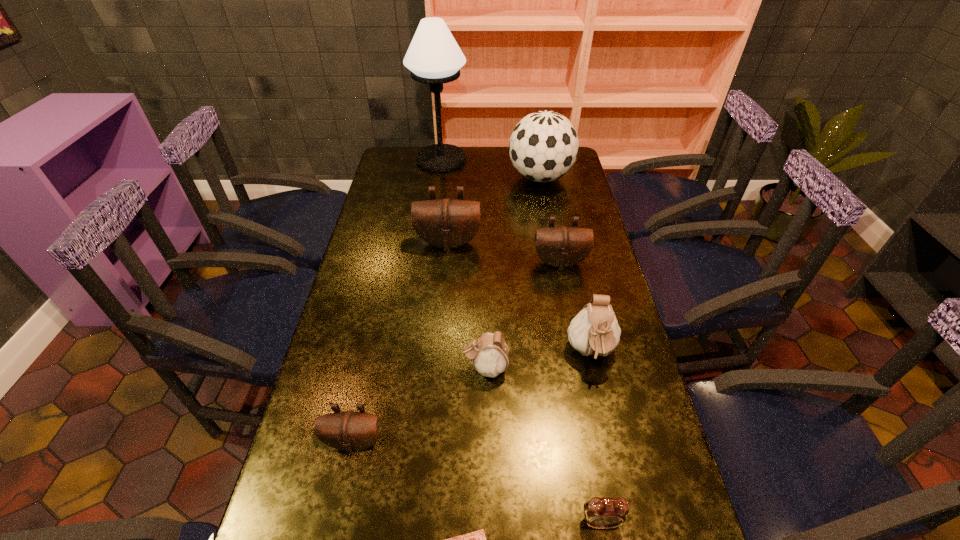
Identify which object is the fourth closest to the nearest pouch. Please provide its 2D coordinates. Your answer should be formatted as a tuple, i.e. [(x, y)], where the tuple contains the x and y coordinates of a point satisfying the conditions above.

[(594, 330)]

Locate which object ranks seventh in proximity to the left white pouch. Please provide its 2D coordinates. Your answer should be formatted as a tuple, i.e. [(x, y)], where the tuple contains the x and y coordinates of a point satisfying the conditions above.

[(543, 147)]

Select which pouch is the closest to the rightmost brown pouch. Please provide its 2D coordinates. Your answer should be formatted as a tuple, i.e. [(x, y)], where the tuple contains the x and y coordinates of a point satisfying the conditions above.

[(446, 223)]

Select which pouch appears as the fourth closest to the second biggest brown pouch. Please provide its 2D coordinates. Your answer should be formatted as a tuple, i.e. [(x, y)], where the tuple contains the x and y coordinates of a point satisfying the conditions above.

[(349, 431)]

Where is `brown pouch that stands as the closest to the nearest brown pouch`? This screenshot has height=540, width=960. brown pouch that stands as the closest to the nearest brown pouch is located at coordinates (446, 223).

What are the coordinates of `brown pouch that stands as the closest to the rightmost brown pouch` in the screenshot? It's located at (446, 223).

Locate an element on the screen. vacant space that satisfies the following two spatial constraints: 1. on the front-facing side of the smaller white pouch; 2. with the flap open on the nearest brown pouch is located at coordinates (486, 442).

Image resolution: width=960 pixels, height=540 pixels. What are the coordinates of `vacant space that satisfies the following two spatial constraints: 1. on the front side of the soccer ball; 2. on the front-facing side of the left white pouch` in the screenshot? It's located at (575, 368).